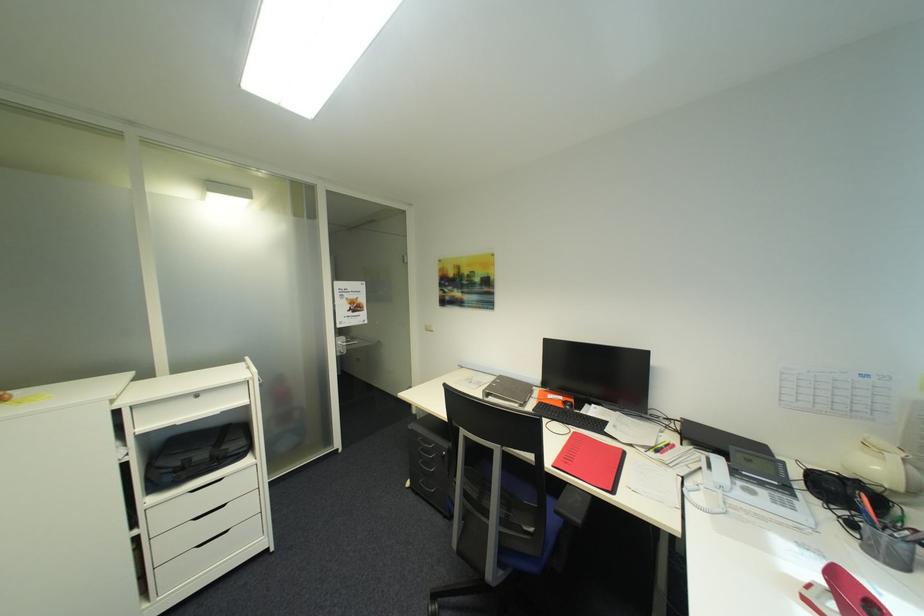
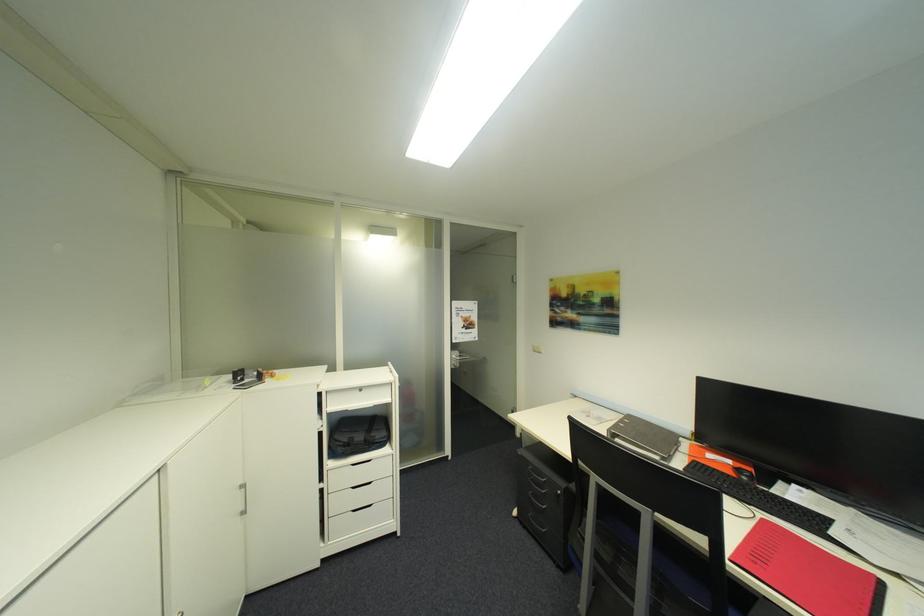
In the second image, find the point that corresponds to (502,382) in the first image.

(628, 422)